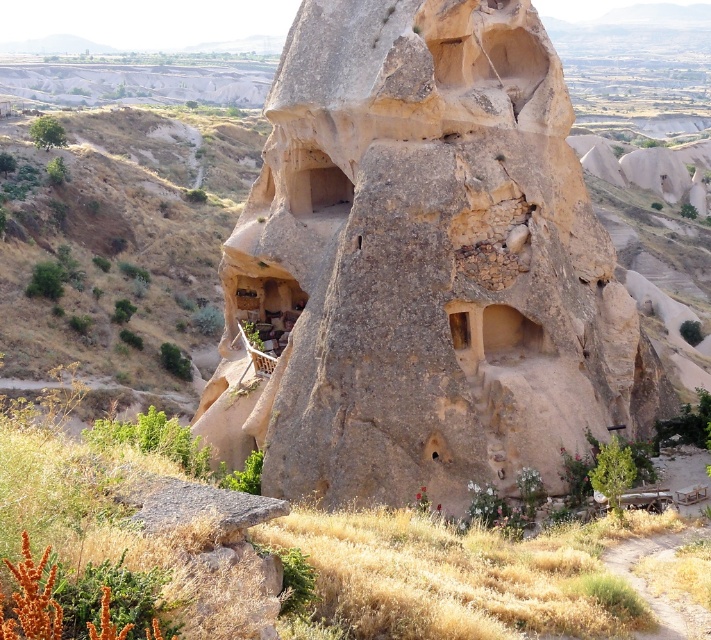
You are standing in the desert and see the brown rough rock formation at center and the brown rough rock at lower left. Which one is positioned more to the right side?

The brown rough rock formation at center is positioned more to the right side compared to the brown rough rock at lower left.

You are standing in the desert landscape looking at the rock house formation. There are two points marked in the image. Based on their positions, which point is closer to you, point (x=351, y=371) or point (x=109, y=358)?

Point (x=351, y=371) is closer to you because it is in front of point (x=109, y=358) according to their spatial arrangement.

You are a geologist examining the image of the desert landscape. You notice the brown rough rock formation at center and the brown rough rock at lower left. Based on their positions, which one is closer to the ground?

The brown rough rock formation at center is closer to the ground because it is positioned below the brown rough rock at lower left.